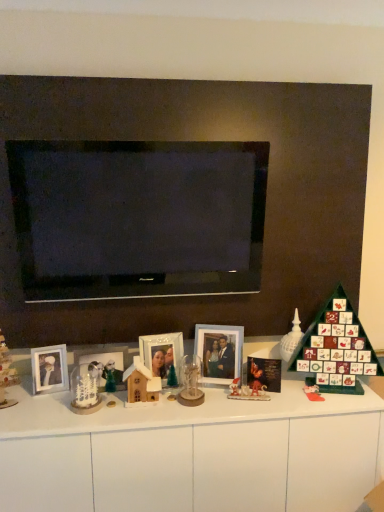
The width and height of the screenshot is (384, 512). What are the coordinates of `free point in front of white glossy seashell at right, which is the second toy from right to left` in the screenshot? It's located at (301, 388).